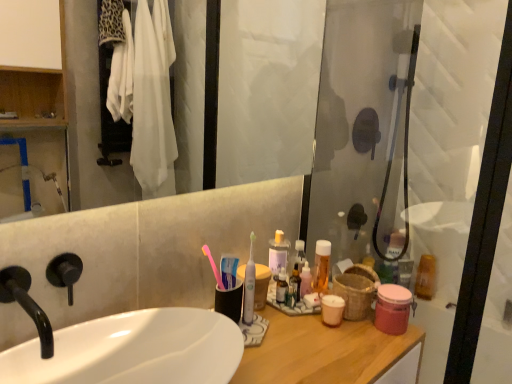
Question: Considering the positions of translucent plastic mouthwash at upper right, which is the first mouthwash in back-to-front order, and black matte faucet at left in the image, is translucent plastic mouthwash at upper right, which is the first mouthwash in back-to-front order, wider or thinner than black matte faucet at left?

Choices:
 (A) thin
 (B) wide

Answer: (B)

Question: Considering their positions, is translucent plastic mouthwash at upper right, which is the first mouthwash in back-to-front order, located in front of or behind black matte faucet at left?

Choices:
 (A) behind
 (B) front

Answer: (A)

Question: Which object is positioned closest to the translucent plastic mouthwash at center, acting as the 1th mouthwash starting from the left?

Choices:
 (A) translucent plastic mouthwash at upper right, arranged as the third mouthwash when viewed from the left
 (B) transparent glass shower door at right
 (C) pink plastic toothbrush at center, marked as the 2th toothbrush in a right-to-left arrangement
 (D) pink matte jar at right, the fourth mouthwash viewed from the back
 (E) white glossy sink at center

Answer: (D)

Question: Estimate the real-world distances between objects in this image. Which object is closer to the pink matte jar at right, the fourth mouthwash viewed from the back?

Choices:
 (A) transparent glass shower door at right
 (B) translucent plastic mouthwash at upper right, the fourth mouthwash from the left
 (C) translucent plastic mouthwash at upper right, which appears as the 4th mouthwash when viewed from the front
 (D) white glossy sink at center
 (E) translucent plastic mouthwash at center, the third mouthwash when ordered from back to front

Answer: (E)